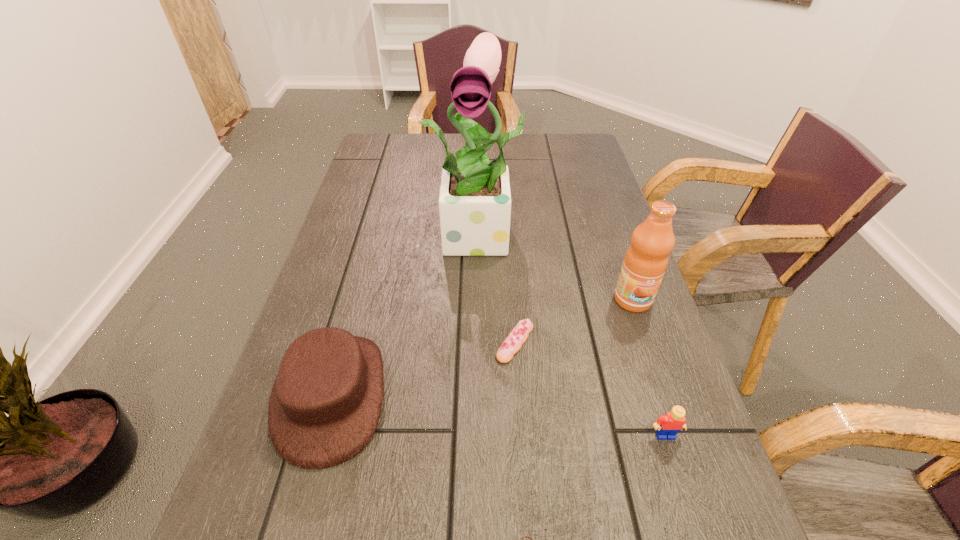
Locate an element on the screen. This screenshot has width=960, height=540. the farthest object is located at coordinates (475, 201).

Locate an element on the screen. the tallest object is located at coordinates (475, 201).

Where is `the fifth shortest object`? This screenshot has width=960, height=540. the fifth shortest object is located at coordinates (645, 262).

You are a GUI agent. You are given a task and a screenshot of the screen. Output one action in this format:
    pyautogui.click(x=<x>, y=<y>)
    Task: Click on the fruit juice
    The image size is (960, 540).
    Given the screenshot: What is the action you would take?
    [645, 262]

The width and height of the screenshot is (960, 540). Identify the location of hat. (325, 404).

Locate an element on the screen. Image resolution: width=960 pixels, height=540 pixels. the third shortest object is located at coordinates (667, 426).

Find the location of `eclair`. eclair is located at coordinates (517, 337).

Locate an element on the screen. The width and height of the screenshot is (960, 540). vacant region located 0.330m on the front-facing side of the farthest object is located at coordinates (484, 387).

Locate an element on the screen. vacant area located 0.290m on the label side of the fruit juice is located at coordinates (682, 443).

The width and height of the screenshot is (960, 540). I want to click on vacant position located 0.210m on the right of the leftmost object, so click(501, 395).